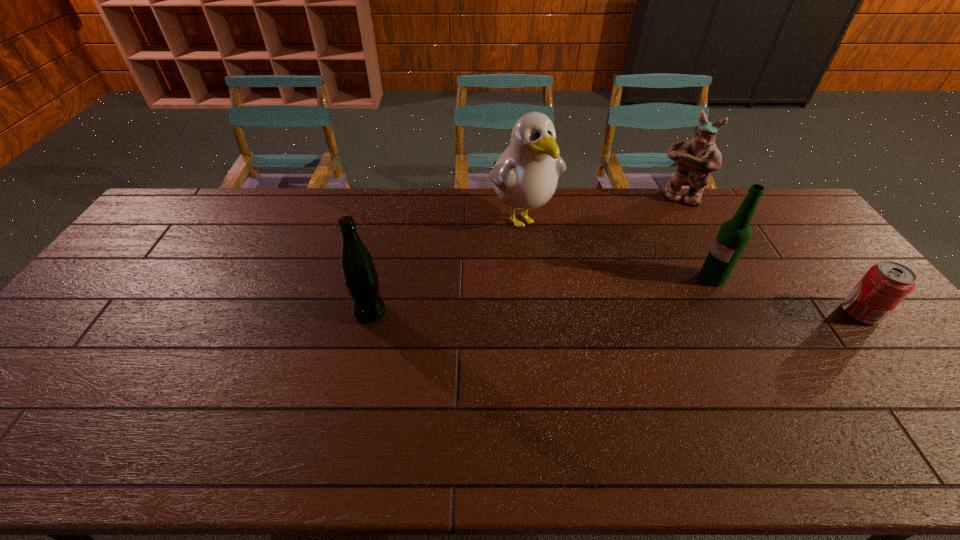
The width and height of the screenshot is (960, 540). I want to click on figurine that is positioned at the far edge, so click(696, 159).

What are the coordinates of `gull located in the far edge section of the desktop` in the screenshot? It's located at (525, 176).

At what (x,y) coordinates should I click in order to perform the action: click on object positioned at the right edge. Please return your answer as a coordinate pair (x, y). The image size is (960, 540). Looking at the image, I should click on coord(886,284).

The image size is (960, 540). I want to click on free space at the far edge of the desktop, so click(661, 223).

Locate an element on the screen. The height and width of the screenshot is (540, 960). free space at the near edge of the desktop is located at coordinates (596, 402).

In the image, there is a desktop. Where is `vacant space at the left edge`? Image resolution: width=960 pixels, height=540 pixels. vacant space at the left edge is located at coordinates (143, 298).

Locate an element on the screen. vacant space at the right edge is located at coordinates [871, 330].

In the image, there is a desktop. In order to click on free region at the far right corner in this screenshot , I will do `click(768, 213)`.

Image resolution: width=960 pixels, height=540 pixels. I want to click on free spot between the rightmost object and the right beer bottle, so click(x=786, y=295).

Identify the location of free point between the nearer beer bottle and the farther beer bottle. (541, 295).